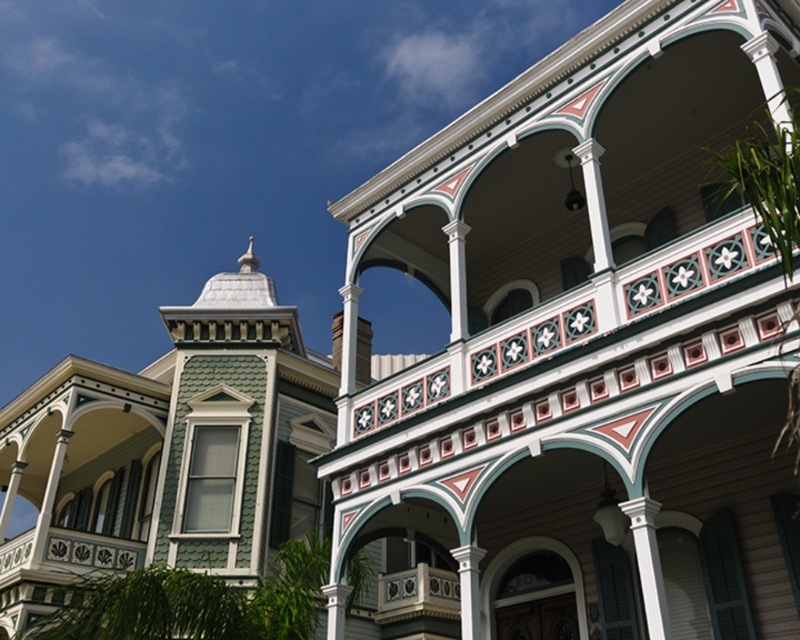
Is white painted wood column at center positioned at the back of white painted wood column at upper center?

No, it is in front of white painted wood column at upper center.

Does white painted wood column at center have a lesser width compared to white painted wood column at upper center?

Indeed, white painted wood column at center has a lesser width compared to white painted wood column at upper center.

In the scene shown: Measure the distance between point (x=649, y=580) and camera.

The distance of point (x=649, y=580) from camera is 13.84 meters.

Where is `white painted wood column at center`? This screenshot has width=800, height=640. white painted wood column at center is located at coordinates 648,564.

The height and width of the screenshot is (640, 800). Describe the element at coordinates (417, 595) in the screenshot. I see `white painted wood balcony at center` at that location.

Is point (420, 580) positioned before point (658, 616)?

No, (420, 580) is further to viewer.

Does point (417, 588) lie in front of point (670, 625)?

No, (417, 588) is further to viewer.

Identify the location of white painted wood balcony at center. (417, 595).

Is white painted wood balcony at center in front of white painted wood column at upper center?

No, white painted wood balcony at center is further to the viewer.

Who is more distant from viewer, (402, 579) or (450, 321)?

The point (402, 579) is behind.

Does point (405, 579) come closer to viewer compared to point (466, 333)?

No, (405, 579) is further to viewer.

The image size is (800, 640). Identify the location of white painted wood balcony at center. (417, 595).